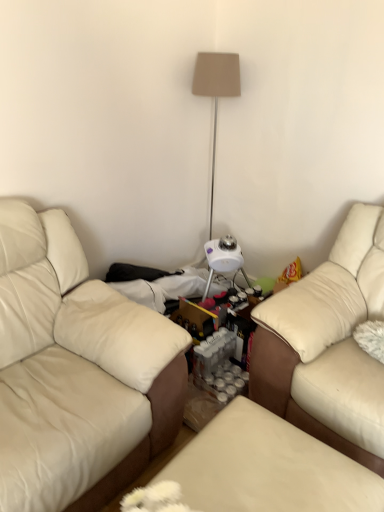
Question: Is beige leather couch at left, the first studio couch when ordered from left to right, not within leather ottoman at center?

Choices:
 (A) yes
 (B) no

Answer: (A)

Question: Is beige leather couch at left, the 2th studio couch from the right, to the right of leather ottoman at center from the viewer's perspective?

Choices:
 (A) no
 (B) yes

Answer: (A)

Question: Could you tell me if beige leather couch at left, the first studio couch when ordered from left to right, is turned towards leather ottoman at center?

Choices:
 (A) no
 (B) yes

Answer: (B)

Question: Considering the relative sizes of beige leather couch at left, the 2th studio couch from the right, and leather ottoman at center in the image provided, is beige leather couch at left, the 2th studio couch from the right, shorter than leather ottoman at center?

Choices:
 (A) no
 (B) yes

Answer: (A)

Question: Is beige leather couch at left, the 2th studio couch from the right, positioned with its back to leather ottoman at center?

Choices:
 (A) yes
 (B) no

Answer: (B)

Question: From a real-world perspective, is beige leather couch at left, the first studio couch when ordered from left to right, located higher than leather ottoman at center?

Choices:
 (A) no
 (B) yes

Answer: (B)

Question: Is leather couch at right, positioned as the 2th studio couch in left-to-right order, positioned beyond the bounds of beige leather couch at left, the first studio couch when ordered from left to right?

Choices:
 (A) no
 (B) yes

Answer: (B)

Question: Considering the relative sizes of leather couch at right, positioned as the 2th studio couch in left-to-right order, and beige leather couch at left, the first studio couch when ordered from left to right, in the image provided, is leather couch at right, positioned as the 2th studio couch in left-to-right order, wider than beige leather couch at left, the first studio couch when ordered from left to right,?

Choices:
 (A) no
 (B) yes

Answer: (A)

Question: From the image's perspective, would you say leather couch at right, positioned as the 2th studio couch in left-to-right order, is shown under beige leather couch at left, the first studio couch when ordered from left to right?

Choices:
 (A) yes
 (B) no

Answer: (B)

Question: Is leather couch at right, which is the 1th studio couch in right-to-left order, facing away from beige leather couch at left, the 2th studio couch from the right?

Choices:
 (A) no
 (B) yes

Answer: (A)

Question: Can you confirm if leather couch at right, positioned as the 2th studio couch in left-to-right order, is bigger than beige leather couch at left, the 2th studio couch from the right?

Choices:
 (A) no
 (B) yes

Answer: (A)

Question: Can you confirm if leather couch at right, positioned as the 2th studio couch in left-to-right order, is thinner than beige leather couch at left, the 2th studio couch from the right?

Choices:
 (A) no
 (B) yes

Answer: (B)

Question: Is beige leather couch at left, the first studio couch when ordered from left to right, at the right side of beige fabric lampshade at upper center?

Choices:
 (A) no
 (B) yes

Answer: (A)